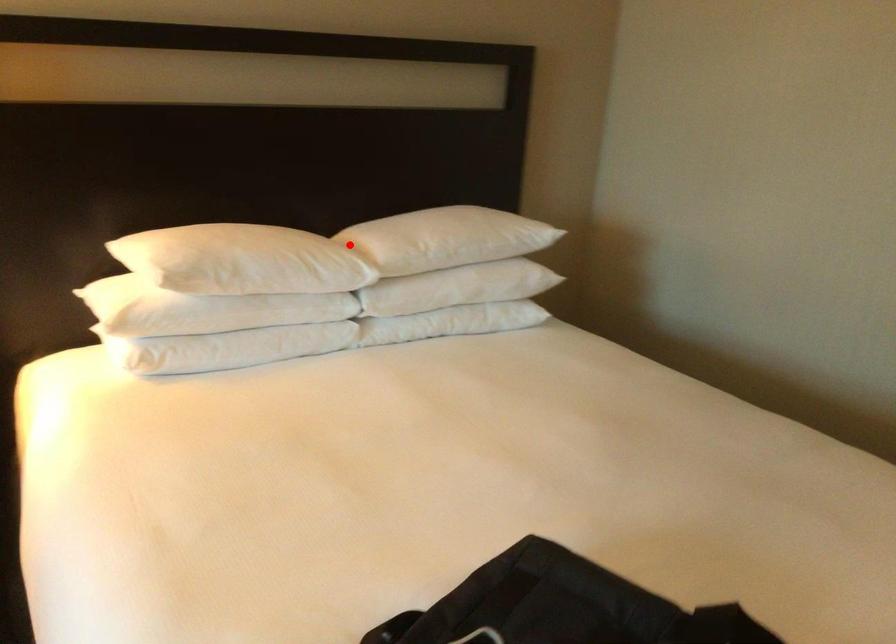
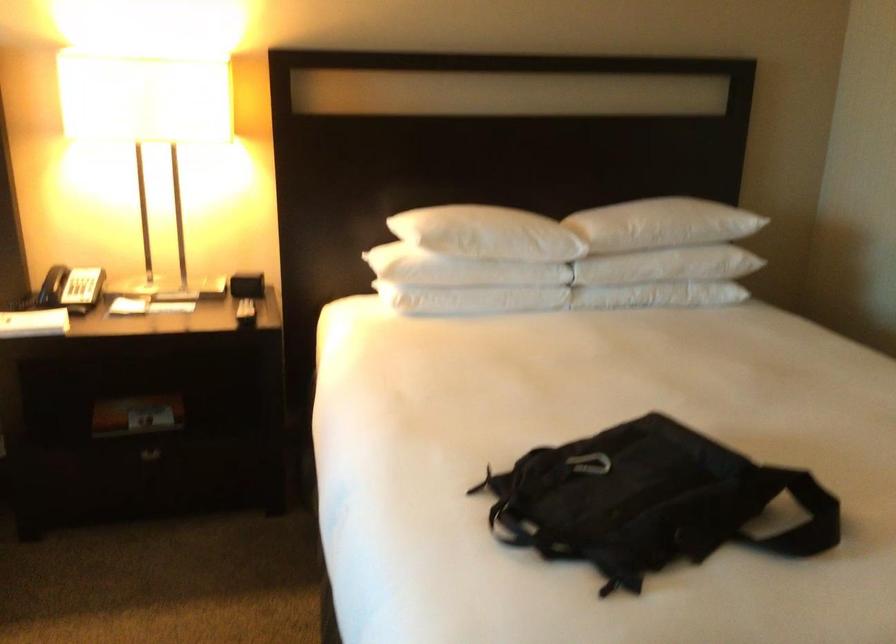
Question: A red point is marked in image1. In image2, is the corresponding 3D point closer to the camera or farther? Reply with the corresponding letter.

Choices:
 (A) The corresponding 3D point is closer.
 (B) The corresponding 3D point is farther.

Answer: (B)